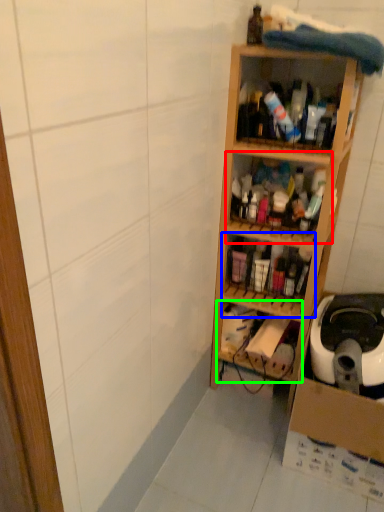
Question: Which object is positioned closest to shelf (highlighted by a red box)? Select from shelf (highlighted by a blue box) and shelf (highlighted by a green box).

Choices:
 (A) shelf
 (B) shelf

Answer: (A)